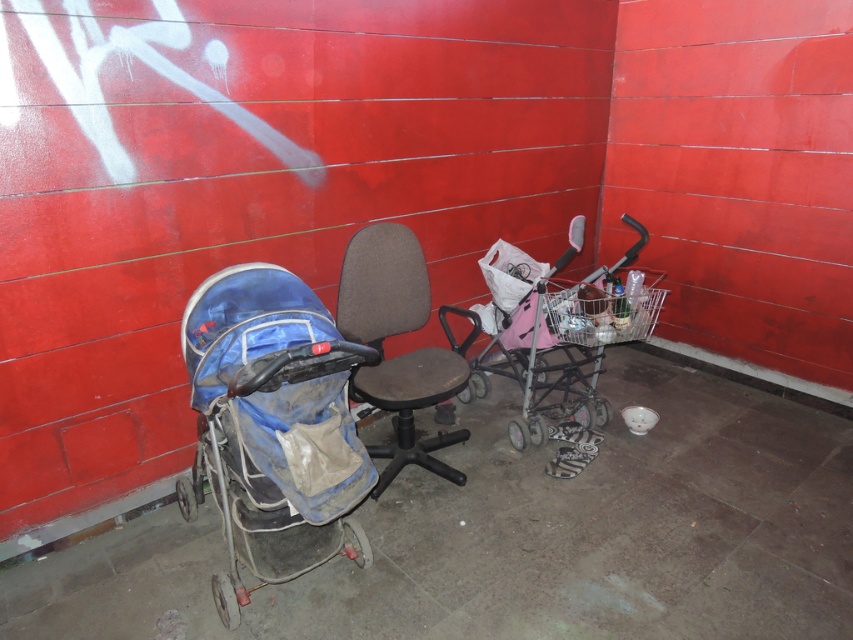
Looking at this image, who is more distant from viewer, (311,419) or (392,273)?

The point (392,273) is more distant.

Does point (294, 285) come in front of point (355, 337)?

Yes, point (294, 285) is closer to viewer.

Does point (235, 621) come closer to viewer compared to point (445, 360)?

Yes, point (235, 621) is closer to viewer.

Where is `blue fabric stroller at left`? Image resolution: width=853 pixels, height=640 pixels. blue fabric stroller at left is located at coordinates (271, 426).

Measure the distance between dark gray fabric office chair at center and camera.

dark gray fabric office chair at center and camera are 2.35 meters apart.

Does dark gray fabric office chair at center appear over pink metallic shopping cart at center-right?

No, dark gray fabric office chair at center is not above pink metallic shopping cart at center-right.

Which is behind, point (364, 296) or point (534, 381)?

Positioned behind is point (534, 381).

Find the location of `dark gray fabric office chair at center`. dark gray fabric office chair at center is located at coordinates (381, 284).

From the picture: Does blue fabric stroller at left have a smaller size compared to pink metallic shopping cart at center-right?

Yes.

Is point (299, 474) positioned in front of point (566, 312)?

Yes, point (299, 474) is closer to viewer.

Where is `blue fabric stroller at left`? blue fabric stroller at left is located at coordinates (271, 426).